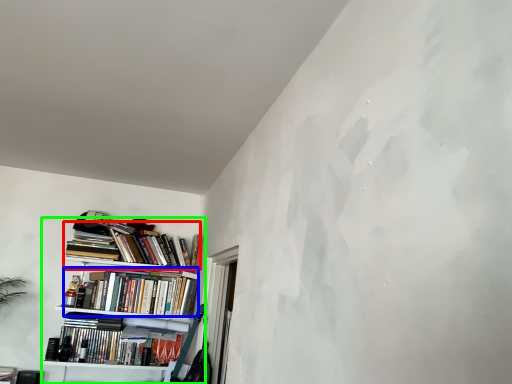
Question: Which object is positioned closest to book (highlighted by a red box)? Select from book (highlighted by a blue box) and bookcase (highlighted by a green box).

Choices:
 (A) book
 (B) bookcase

Answer: (B)